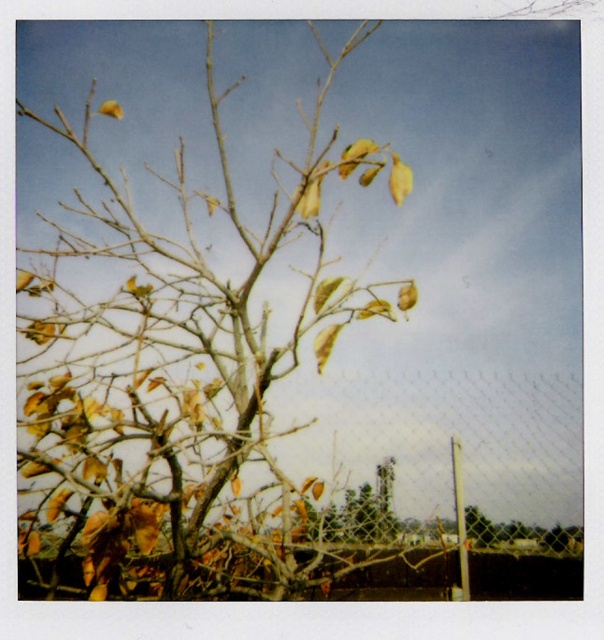
Between brown dry branch at center and green matte tree at center, which one is positioned higher?

Positioned higher is brown dry branch at center.

Is point (164, 488) positioned after point (384, 484)?

No, it is in front of (384, 484).

Is point (94, 216) farther from camera compared to point (381, 524)?

No.

The image size is (604, 640). In order to click on brown dry branch at center in this screenshot , I will do `click(185, 376)`.